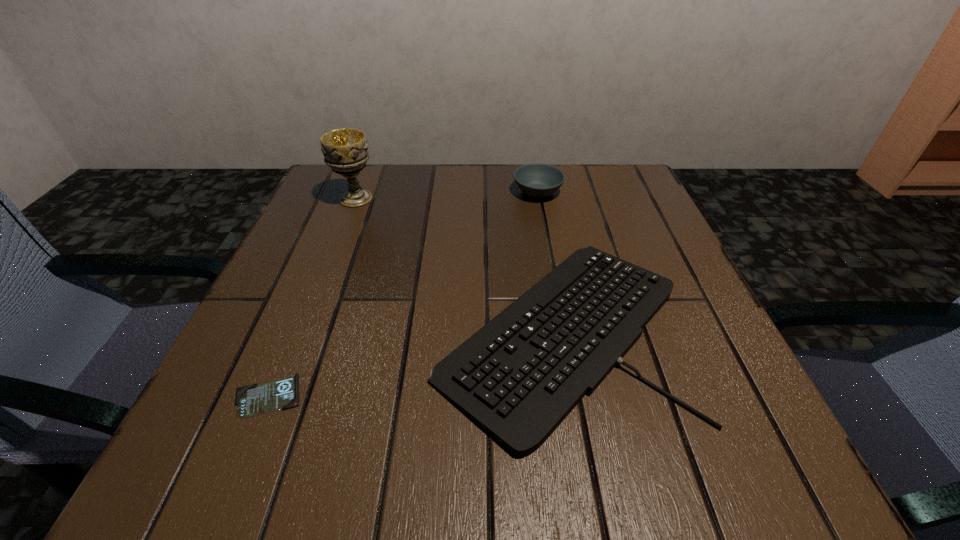
Where is `free space between the tallest object and the shortest object`? free space between the tallest object and the shortest object is located at coordinates (312, 297).

The height and width of the screenshot is (540, 960). I want to click on free space between the tallest object and the soup bowl, so click(x=446, y=195).

Locate an element on the screen. vacant space that's between the tallest object and the shortest object is located at coordinates (312, 297).

Where is `free point between the identity card and the third tallest object`? The height and width of the screenshot is (540, 960). free point between the identity card and the third tallest object is located at coordinates (415, 363).

I want to click on object that stands as the closest to the tallest object, so click(518, 377).

Where is `object identified as the second closest to the identity card`? object identified as the second closest to the identity card is located at coordinates (345, 150).

The width and height of the screenshot is (960, 540). I want to click on vacant space that satisfies the following two spatial constraints: 1. on the back side of the chalice; 2. on the left side of the identity card, so click(x=349, y=199).

You are a GUI agent. You are given a task and a screenshot of the screen. Output one action in this format:
    pyautogui.click(x=<x>, y=<y>)
    Task: Click on the free space that satisfies the following two spatial constraints: 1. on the front side of the second shortest object; 2. on the right side of the chalice
    
    Given the screenshot: What is the action you would take?
    pyautogui.click(x=305, y=330)

Where is `vacant space that satisfies the following two spatial constraints: 1. on the back side of the computer keyboard; 2. on the right side of the identity card`? This screenshot has height=540, width=960. vacant space that satisfies the following two spatial constraints: 1. on the back side of the computer keyboard; 2. on the right side of the identity card is located at coordinates (296, 330).